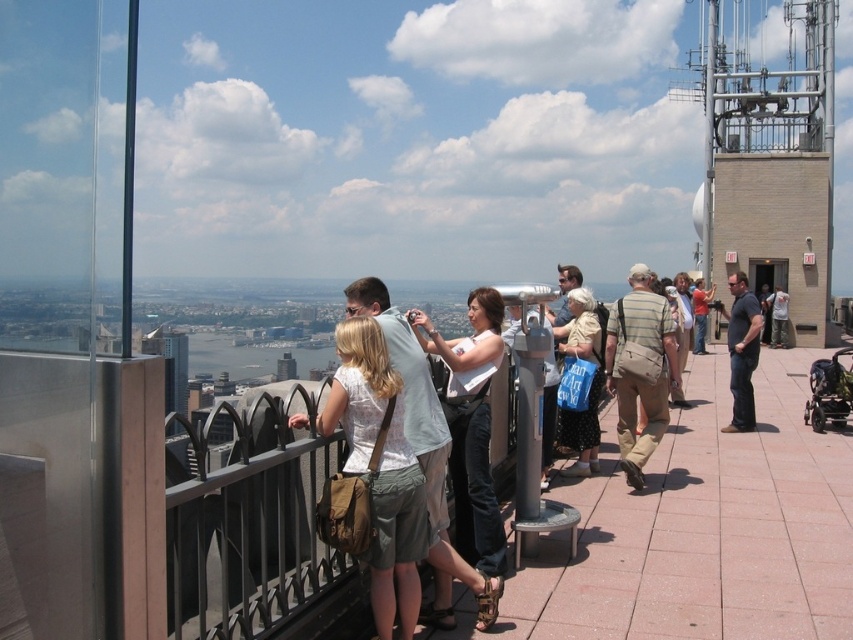
Can you confirm if matte brown bag at center is bigger than red shirt at center?

Incorrect, matte brown bag at center is not larger than red shirt at center.

Is point (405, 493) positioned after point (704, 307)?

No, it is in front of (704, 307).

You are a GUI agent. You are given a task and a screenshot of the screen. Output one action in this format:
    pyautogui.click(x=<x>, y=<y>)
    Task: Click on the matte brown bag at center
    
    Given the screenshot: What is the action you would take?
    pyautogui.click(x=380, y=470)

Which is below, tan canvas bag at center or red shirt at center?

tan canvas bag at center is below.

Can you confirm if tan canvas bag at center is bigger than red shirt at center?

Correct, tan canvas bag at center is larger in size than red shirt at center.

Locate an element on the screen. This screenshot has height=640, width=853. tan canvas bag at center is located at coordinates tap(637, 374).

Is matte brown bag at center taller than white fabric shirt at center?

No, matte brown bag at center is not taller than white fabric shirt at center.

Can you confirm if matte brown bag at center is positioned above white fabric shirt at center?

Actually, matte brown bag at center is below white fabric shirt at center.

Does point (346, 429) lie in front of point (463, 365)?

That is True.

The image size is (853, 640). I want to click on matte brown bag at center, so click(x=380, y=470).